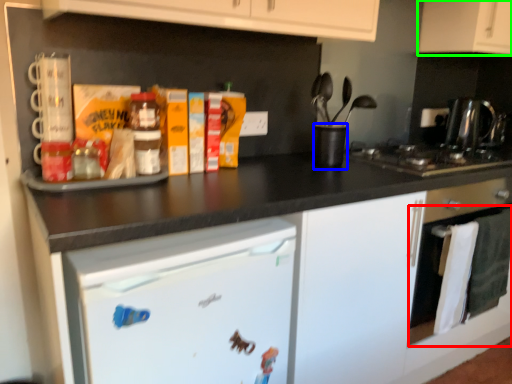
Question: Which object is the farthest from oven (highlighted by a red box)? Choose among these: appliance (highlighted by a blue box) or cabinetry (highlighted by a green box).

Choices:
 (A) appliance
 (B) cabinetry

Answer: (B)